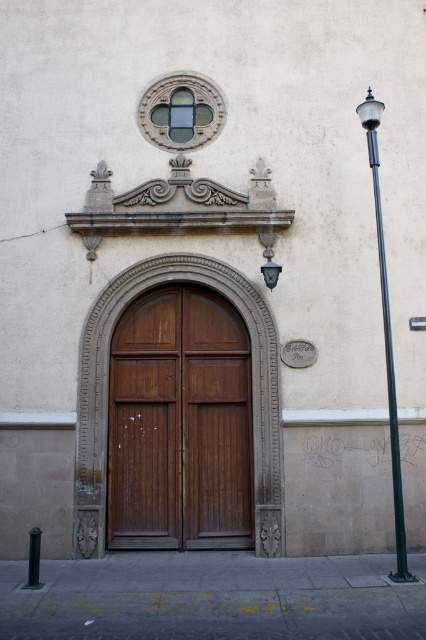
You are a painter who needs to decide whether to use a ladder or a step stool to reach the top of the wooden door at center and the black metal pole at right. Based on their sizes, which tool would be more appropriate for each object?

The wooden door at center has a smaller size compared to the black metal pole at right. Therefore, the step stool would be sufficient for the wooden door at center, while the ladder would be necessary for the taller black metal pole at right.

You are a delivery person with a package that requires a 10 feet clearance to maneuver safely. You are standing at the entrance of the building and need to move your cart from the black metal pole at right to the wooden door at center. Can you safely navigate the space between them without hitting anything?

The wooden door at center is 9.99 feet from the black metal pole at right. Since the required clearance is 10 feet, the distance is just shy of the needed clearance. Therefore, navigating the space might be risky and not fully safe.

You are standing at the entrance of the building and want to locate the wooden door at center. According to the coordinates provided, where would you find it?

The wooden door at center is located at point coordinates of (x=180, y=424).